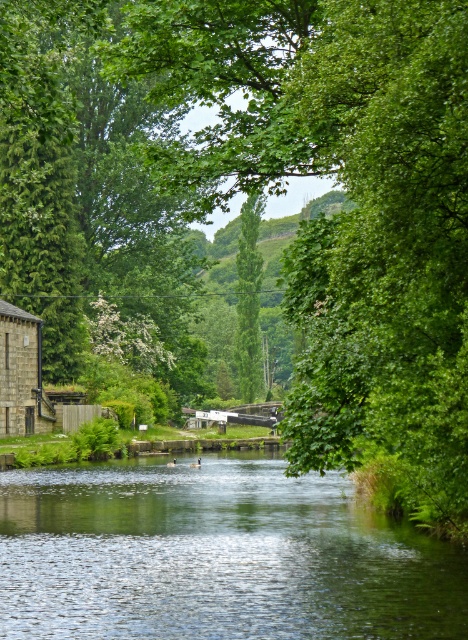
You are standing at the lock gate in the canal scene and want to reach both points marked in the image. Which point, point (243, 628) or point (29, 376), is closer to you?

Point (243, 628) is closer to the viewer than point (29, 376).

You are a boat captain navigating a narrow canal. Your boat is 10 meters wide. You see the green glossy water at center and the green leafy tree at center in the scene. Which object can your boat safely pass through without touching the sides?

The green glossy water at center is wider than the green leafy tree at center, so the boat can safely pass through the green glossy water at center since it is wider than the boat.

You are standing at the point marked by coordinates point (216, 556). What is the surface you are currently standing on?

The surface at point (216, 556) is green glossy water at center.